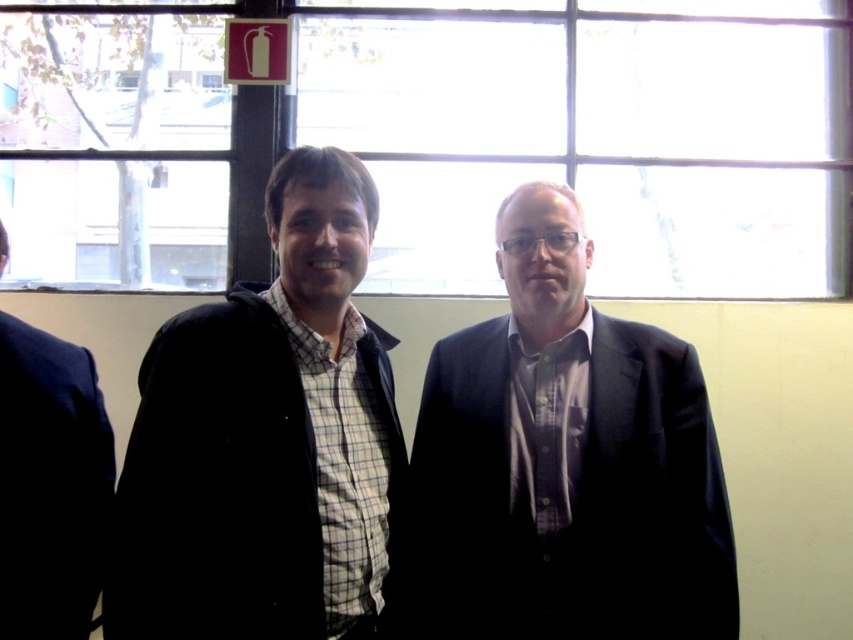
Question: Which of the following is the closest to the observer?

Choices:
 (A) clear glass window at upper center
 (B) matte black jacket at center

Answer: (B)

Question: Is clear glass window at upper center bigger than matte black jacket at center?

Choices:
 (A) yes
 (B) no

Answer: (A)

Question: Estimate the real-world distances between objects in this image. Which object is closer to the dark gray suit at center?

Choices:
 (A) matte black jacket at center
 (B) clear glass window at upper center

Answer: (A)

Question: Is clear glass window at upper center positioned behind matte black jacket at left?

Choices:
 (A) no
 (B) yes

Answer: (B)

Question: Which point is farther to the camera?

Choices:
 (A) (607, 401)
 (B) (271, 442)

Answer: (A)

Question: Is clear glass window at upper center positioned at the back of matte black jacket at left?

Choices:
 (A) yes
 (B) no

Answer: (A)